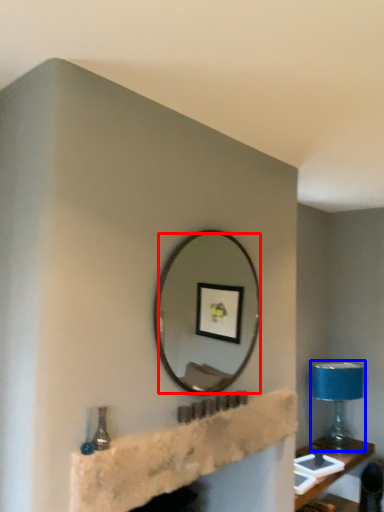
Question: Among these objects, which one is farthest to the camera, mirror (highlighted by a red box) or table lamp (highlighted by a blue box)?

Choices:
 (A) mirror
 (B) table lamp

Answer: (B)